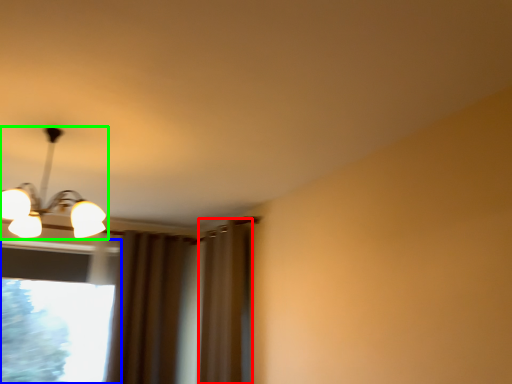
Question: Which object is the closest to the curtain (highlighted by a red box)? Choose among these: window (highlighted by a blue box) or lamp (highlighted by a green box).

Choices:
 (A) window
 (B) lamp

Answer: (A)